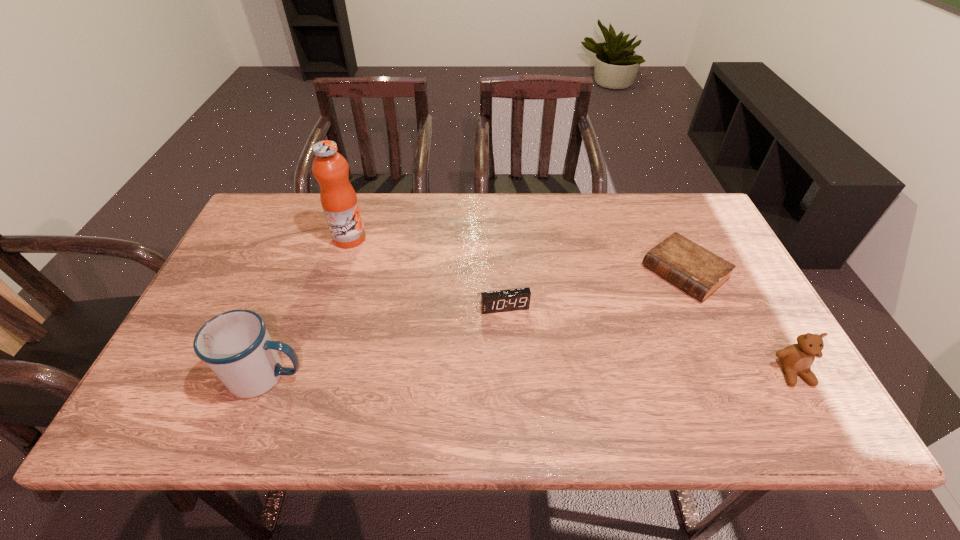
This screenshot has width=960, height=540. Identify the location of free region located on the front-facing side of the alarm clock. (521, 364).

Image resolution: width=960 pixels, height=540 pixels. In order to click on vacant space located on the front-facing side of the alarm clock in this screenshot , I will do `click(520, 361)`.

Where is `vacant space located on the front-facing side of the alarm clock`? The width and height of the screenshot is (960, 540). vacant space located on the front-facing side of the alarm clock is located at coordinates (518, 354).

Where is `vacant space located on the spine side of the shortest object`? The height and width of the screenshot is (540, 960). vacant space located on the spine side of the shortest object is located at coordinates (612, 332).

Find the location of a particular element. Image resolution: width=960 pixels, height=540 pixels. free spot located 0.140m on the spine side of the shortest object is located at coordinates (627, 320).

Locate an element on the screen. This screenshot has width=960, height=540. free space located on the spine side of the shortest object is located at coordinates (590, 349).

Where is `object that is at the far edge`? The height and width of the screenshot is (540, 960). object that is at the far edge is located at coordinates (339, 201).

Find the location of a particular element. The height and width of the screenshot is (540, 960). mug present at the near edge is located at coordinates (235, 345).

Find the location of a particular element. teddy bear that is at the near edge is located at coordinates (797, 358).

This screenshot has height=540, width=960. What are the coordinates of `object that is at the left edge` in the screenshot? It's located at (235, 345).